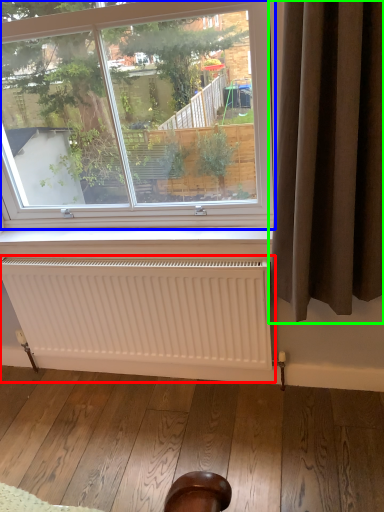
Question: Which is farther away from radiator (highlighted by a red box)? window (highlighted by a blue box) or curtain (highlighted by a green box)?

Choices:
 (A) window
 (B) curtain

Answer: (B)